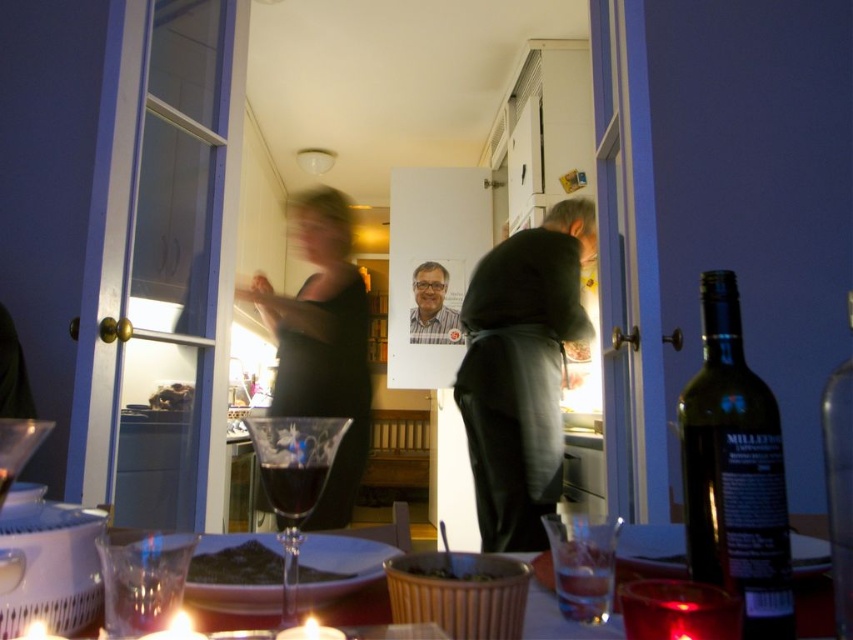
Looking at this image, can you confirm if black matte dress at center is positioned below translucent glass candle at lower center?

Actually, black matte dress at center is above translucent glass candle at lower center.

Is point (352, 337) farther from camera compared to point (552, 577)?

Yes, it is behind point (552, 577).

Where is `black matte dress at center`? The width and height of the screenshot is (853, 640). black matte dress at center is located at coordinates (323, 342).

Looking at this image, which is more to the left, dark glass bottle at right or smooth chocolate bar at center?

Positioned to the left is smooth chocolate bar at center.

Which of these two, dark glass bottle at right or smooth chocolate bar at center, stands taller?

dark glass bottle at right

Between point (775, 493) and point (184, 408), which one is positioned behind?

The point (184, 408) is behind.

Where is `dark glass bottle at right`? This screenshot has width=853, height=640. dark glass bottle at right is located at coordinates (734, 472).

Can you confirm if translucent glass candle at lower center is smaller than green leafy salad at center?

Actually, translucent glass candle at lower center might be larger than green leafy salad at center.

Does point (804, 620) come closer to viewer compared to point (265, 560)?

Yes.

Between point (538, 556) and point (253, 573), which one is positioned in front?

Positioned in front is point (253, 573).

You are a GUI agent. You are given a task and a screenshot of the screen. Output one action in this format:
    pyautogui.click(x=<x>, y=<y>)
    Task: Click on the translucent glass candle at lower center
    Image resolution: width=853 pixels, height=640 pixels.
    Given the screenshot: What is the action you would take?
    pyautogui.click(x=811, y=586)